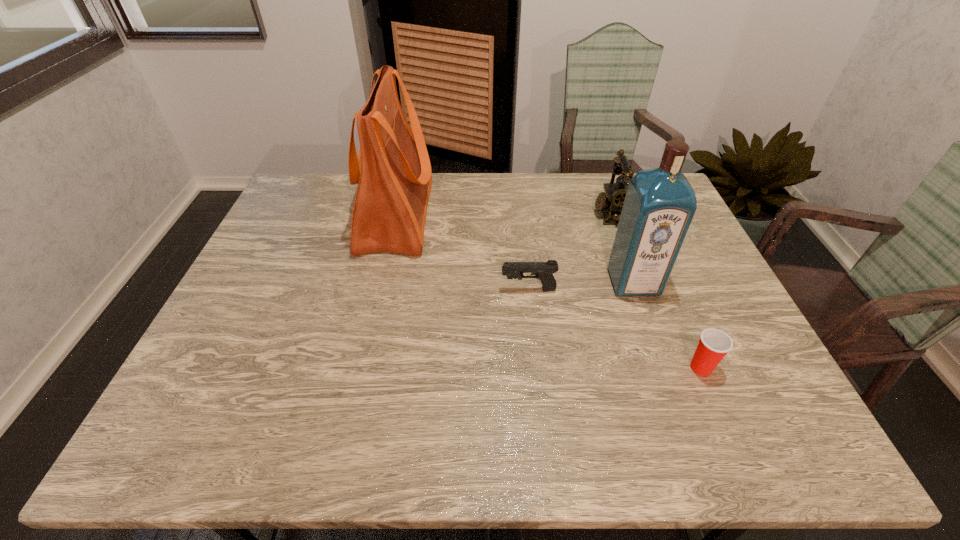
Select which object is the third closest to the pistol. Please provide its 2D coordinates. Your answer should be formatted as a tuple, i.e. [(x, y)], where the tuple contains the x and y coordinates of a point satisfying the conditions above.

[(613, 198)]

Where is `object that is the third nearest to the Dixie cup`? This screenshot has width=960, height=540. object that is the third nearest to the Dixie cup is located at coordinates (613, 198).

You are a GUI agent. You are given a task and a screenshot of the screen. Output one action in this format:
    pyautogui.click(x=<x>, y=<y>)
    Task: Click on the vacant space that satisfies the following two spatial constraints: 1. at the barrel of the pistol; 2. on the back side of the Dixie cup
    The width and height of the screenshot is (960, 540).
    Given the screenshot: What is the action you would take?
    pyautogui.click(x=537, y=368)

Find the location of a particular element. vacant position in the image that satisfies the following two spatial constraints: 1. on the front pocket of the shopping bag; 2. on the back side of the nearest object is located at coordinates (361, 368).

Identify the location of free location that satisfies the following two spatial constraints: 1. on the flat label side of the nearest object; 2. on the left side of the liquor. (663, 368).

In order to click on free space in the image that satisfies the following two spatial constraints: 1. on the back side of the nearest object; 2. on the front pocket of the shopping bag in this screenshot , I will do `click(636, 215)`.

Identify the location of vacant space that satisfies the following two spatial constraints: 1. on the front pocket of the shopping bag; 2. on the right side of the Dixie cup. Image resolution: width=960 pixels, height=540 pixels. (361, 368).

You are a GUI agent. You are given a task and a screenshot of the screen. Output one action in this format:
    pyautogui.click(x=<x>, y=<y>)
    Task: Click on the free space that satisfies the following two spatial constraints: 1. on the flat label side of the liquor; 2. on the left side of the nearest object
    This screenshot has width=960, height=540.
    Given the screenshot: What is the action you would take?
    pyautogui.click(x=663, y=368)

I want to click on vacant space that satisfies the following two spatial constraints: 1. on the front pocket of the shopping bag; 2. on the back side of the nearest object, so click(x=361, y=368).